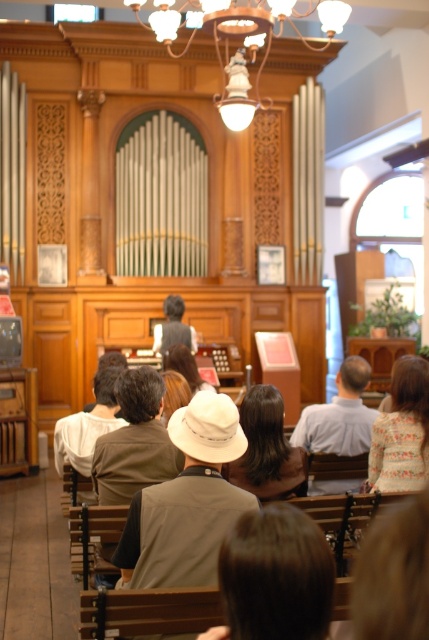
Consider the image. Which is more to the left, matte brass chandelier at upper center or light brown leather jacket at center?

Positioned to the left is light brown leather jacket at center.

Is matte brass chandelier at upper center closer to the viewer compared to light brown leather jacket at center?

That is True.

The image size is (429, 640). Describe the element at coordinates (238, 40) in the screenshot. I see `matte brass chandelier at upper center` at that location.

Where is `matte brass chandelier at upper center`? matte brass chandelier at upper center is located at coordinates (238, 40).